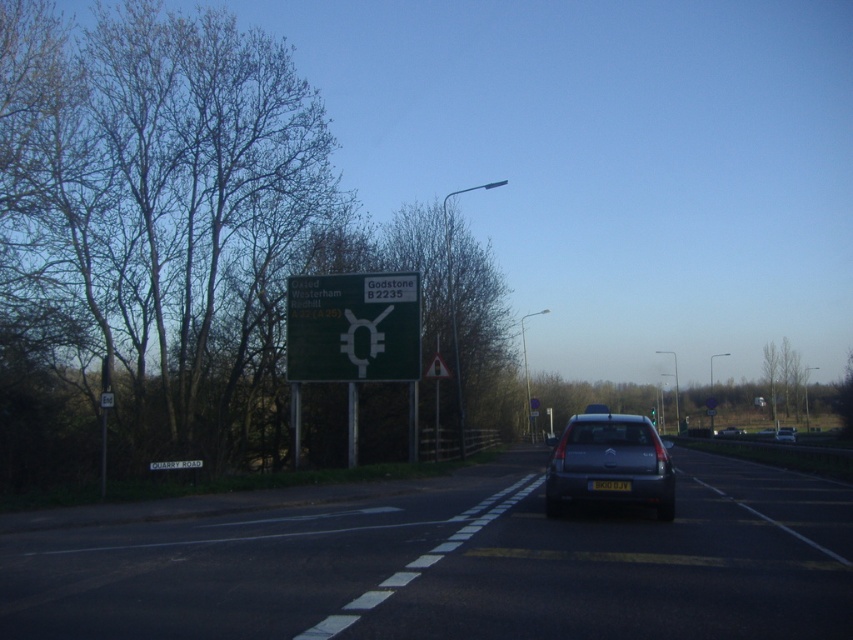
Does black asphalt road at center have a lesser width compared to yellow reflective triangle at center?

In fact, black asphalt road at center might be wider than yellow reflective triangle at center.

Is black asphalt road at center below yellow reflective triangle at center?

Yes.

The height and width of the screenshot is (640, 853). What are the coordinates of `black asphalt road at center` in the screenshot? It's located at (453, 564).

Is black asphalt road at center closer to the viewer compared to metallic silver car at center?

Yes, black asphalt road at center is in front of metallic silver car at center.

Is point (613, 566) in front of point (782, 428)?

That is True.

Between point (706, 467) and point (793, 436), which one is positioned behind?

Point (793, 436)

This screenshot has height=640, width=853. I want to click on black asphalt road at center, so click(x=453, y=564).

In the scene shown: Can you confirm if black plastic license plate at center is taller than metallic silver car at center?

No, black plastic license plate at center is not taller than metallic silver car at center.

Does point (612, 483) lie in front of point (793, 440)?

Yes, it is in front of point (793, 440).

Where is `black plastic license plate at center`? The height and width of the screenshot is (640, 853). black plastic license plate at center is located at coordinates (608, 484).